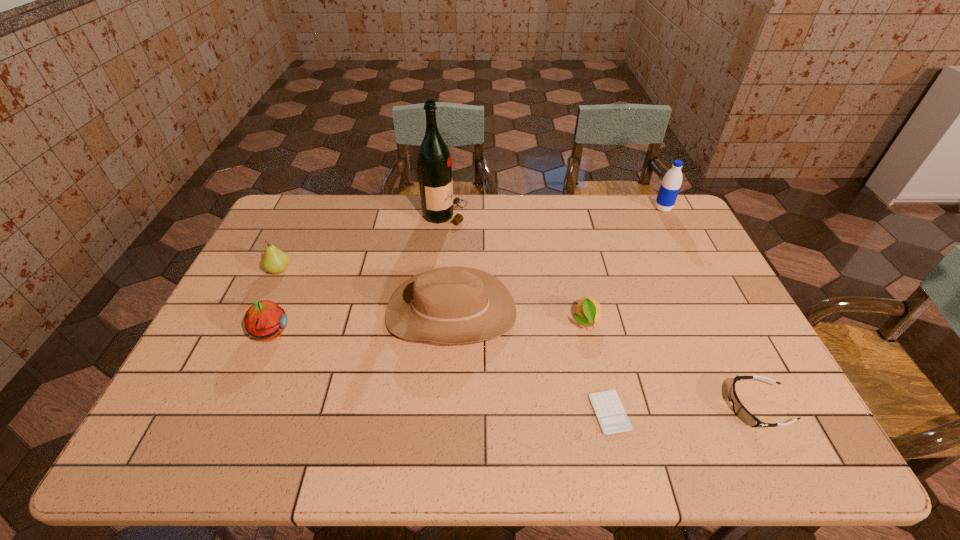
In the image, there is a desktop. Where is `vacant area at the left edge`? vacant area at the left edge is located at coordinates (269, 242).

In the image, there is a desktop. At what (x,y) coordinates should I click in order to perform the action: click on free space at the right edge. Please return your answer as a coordinate pair (x, y). Looking at the image, I should click on (673, 245).

Identify the location of free space between the pear and the cowboy hat. The image size is (960, 540). (365, 291).

At what (x,y) coordinates should I click in order to perform the action: click on free spot between the apple and the seventh tallest object. Please return your answer as a coordinate pair (x, y). The height and width of the screenshot is (540, 960). Looking at the image, I should click on (514, 370).

Where is `blank region between the cowboy hat and the goggles`? The height and width of the screenshot is (540, 960). blank region between the cowboy hat and the goggles is located at coordinates (604, 359).

This screenshot has width=960, height=540. What are the coordinates of `free space between the pear and the apple` in the screenshot? It's located at (275, 302).

Locate an element on the screen. Image resolution: width=960 pixels, height=540 pixels. vacant area between the goggles and the sixth tallest object is located at coordinates (671, 363).

Where is `vacant region between the calculator and the third shortest object`? vacant region between the calculator and the third shortest object is located at coordinates tap(597, 367).

Image resolution: width=960 pixels, height=540 pixels. What are the coordinates of `vacant space that's between the water bottle and the lemon` in the screenshot? It's located at (624, 265).

At what (x,y) coordinates should I click in order to perform the action: click on free spot between the tallest object and the calculator. Please return your answer as a coordinate pair (x, y). The width and height of the screenshot is (960, 540). Looking at the image, I should click on (527, 313).